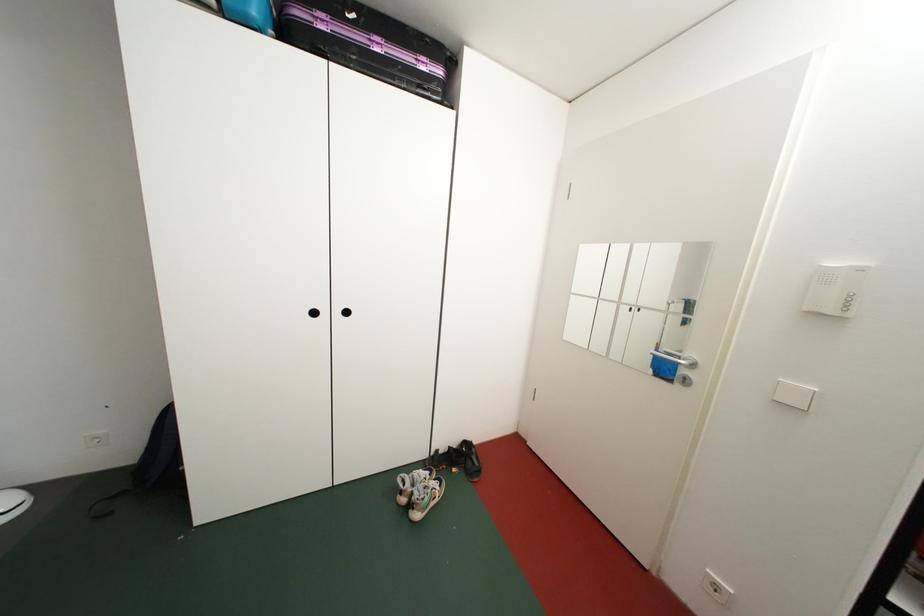
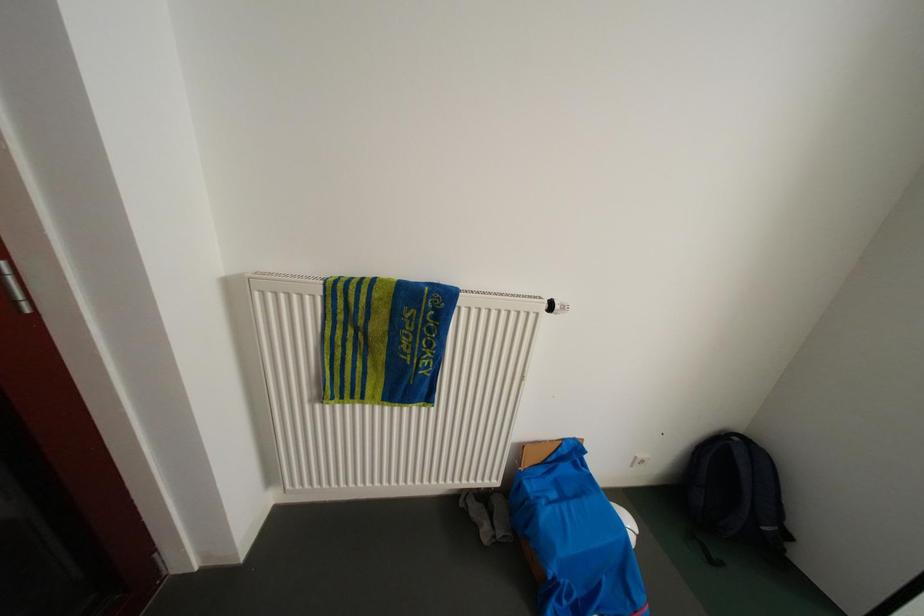
Question: What movement of the cameraman would produce the second image?

Choices:
 (A) Left
 (B) Right
 (C) Forward
 (D) Backward

Answer: (A)